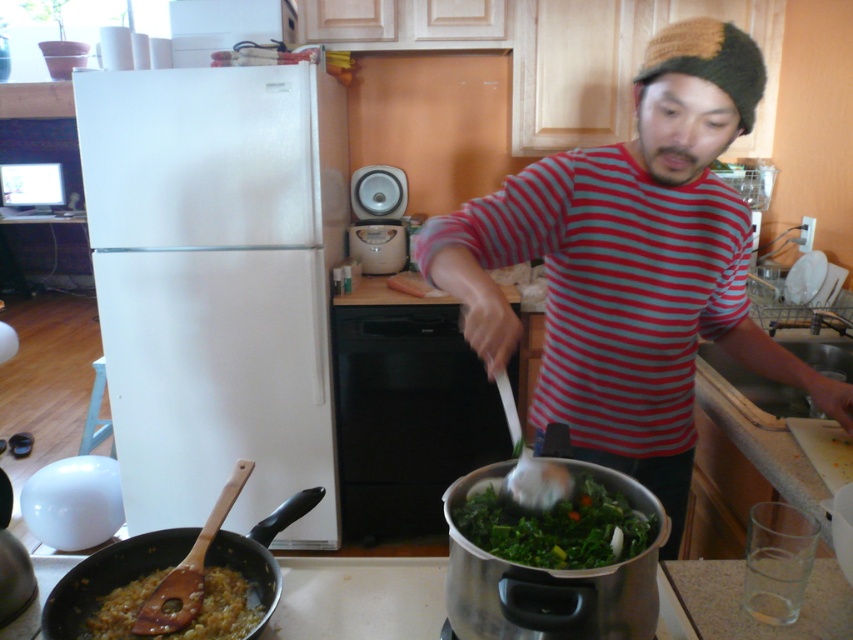
You are a chef observing the kitchen scene. You need to adjust the stove flame under the green leafy vegetables at center. Which direction should you move your hand to reach the stove controls, considering the position of the striped cotton shirt at center?

The striped cotton shirt at center is on the right side of the green leafy vegetables at center. Since the shirt is to the right, the stove controls are likely to the left of the vegetables. Move your hand to the left to adjust the flame under the green leafy vegetables at center.

You are a chef trying to determine which item is wider between the green leafy vegetables at center and the brown matte wooden spoon at lower left. Which one is wider?

The green leafy vegetables at center are wider than the brown matte wooden spoon at lower left according to their widths.

You are a chef preparing a dish and need to know which object is taller between the green leafy vegetables at center and the brown matte wooden spoon at lower left. Can you determine this?

The green leafy vegetables at center are taller than the brown matte wooden spoon at lower left according to the description.